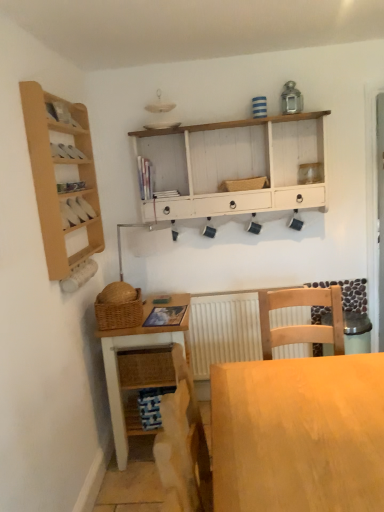
The width and height of the screenshot is (384, 512). What are the coordinates of `free space above wooden table at lower center (from a real-world perspective)` in the screenshot? It's located at (153, 316).